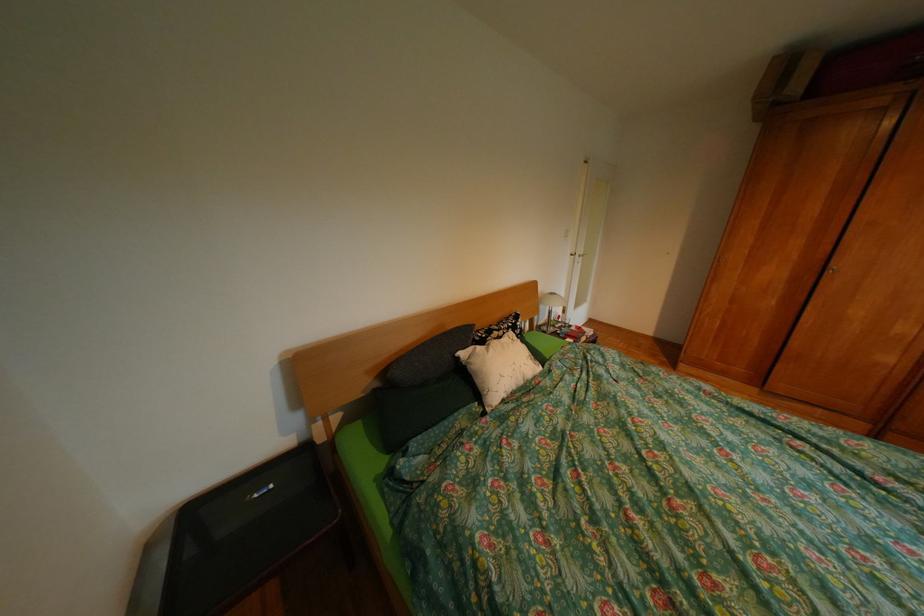
Find the location of a particular element. Image resolution: width=924 pixels, height=616 pixels. wardrobe door lock is located at coordinates (831, 270).